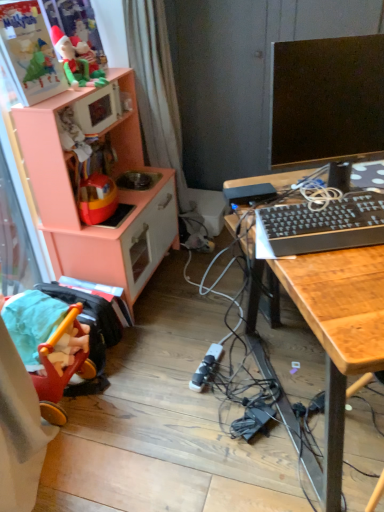
Question: Is matte green plush toy at upper left at the left side of peach wood toy kitchen at left?

Choices:
 (A) no
 (B) yes

Answer: (B)

Question: Could peach wood toy kitchen at left be considered to be inside matte green plush toy at upper left?

Choices:
 (A) yes
 (B) no

Answer: (B)

Question: Can you confirm if matte green plush toy at upper left is shorter than peach wood toy kitchen at left?

Choices:
 (A) no
 (B) yes

Answer: (B)

Question: From a real-world perspective, is matte green plush toy at upper left located higher than peach wood toy kitchen at left?

Choices:
 (A) yes
 (B) no

Answer: (A)

Question: From the image's perspective, would you say matte green plush toy at upper left is positioned over peach wood toy kitchen at left?

Choices:
 (A) yes
 (B) no

Answer: (A)

Question: Based on their sizes in the image, would you say matte green plush toy at upper left is bigger or smaller than black plastic keyboard at right?

Choices:
 (A) small
 (B) big

Answer: (A)

Question: Would you say matte green plush toy at upper left is inside or outside black plastic keyboard at right?

Choices:
 (A) outside
 (B) inside

Answer: (A)

Question: From a real-world perspective, is matte green plush toy at upper left above or below black plastic keyboard at right?

Choices:
 (A) above
 (B) below

Answer: (A)

Question: In terms of width, does matte green plush toy at upper left look wider or thinner when compared to black plastic keyboard at right?

Choices:
 (A) wide
 (B) thin

Answer: (B)

Question: Is peach wood toy kitchen at left inside or outside of black plastic plug at center?

Choices:
 (A) inside
 (B) outside

Answer: (B)

Question: In terms of size, does peach wood toy kitchen at left appear bigger or smaller than black plastic plug at center?

Choices:
 (A) small
 (B) big

Answer: (B)

Question: Considering the positions of point (71, 232) and point (213, 369), is point (71, 232) closer or farther from the camera than point (213, 369)?

Choices:
 (A) farther
 (B) closer

Answer: (A)

Question: From the image's perspective, is peach wood toy kitchen at left above or below black plastic plug at center?

Choices:
 (A) above
 (B) below

Answer: (A)

Question: Is black plastic keyboard at right situated inside white fabric curtain at center or outside?

Choices:
 (A) outside
 (B) inside

Answer: (A)

Question: Would you say black plastic keyboard at right is to the left or to the right of white fabric curtain at center in the picture?

Choices:
 (A) left
 (B) right

Answer: (B)